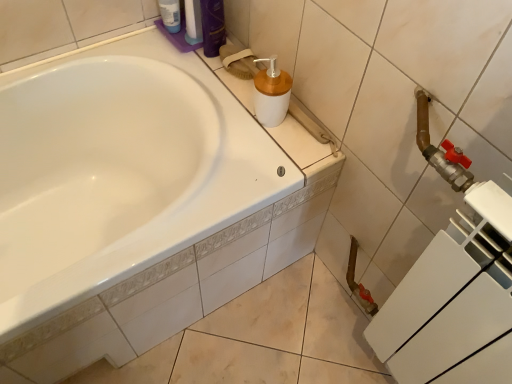
Question: In the image, is shiny purple bottle at upper center, which is the 1th toiletry from right to left, on the left side or the right side of translucent plastic bottle at upper left, the second toiletry positioned from the right?

Choices:
 (A) right
 (B) left

Answer: (A)

Question: Is shiny purple bottle at upper center, which is the 1th toiletry from right to left, taller or shorter than translucent plastic bottle at upper left, the second toiletry positioned from the right?

Choices:
 (A) tall
 (B) short

Answer: (A)

Question: Estimate the real-world distances between objects in this image. Which object is farther from the white matte plastic soap dispenser at upper center?

Choices:
 (A) translucent plastic bottle at upper left, the second toiletry positioned from the right
 (B) shiny purple bottle at upper center, positioned as the second toiletry in left-to-right order

Answer: (A)

Question: Considering the real-world distances, which object is farthest from the white matte plastic soap dispenser at upper center?

Choices:
 (A) translucent plastic bottle at upper left, the second toiletry positioned from the right
 (B) shiny purple bottle at upper center, positioned as the second toiletry in left-to-right order

Answer: (A)